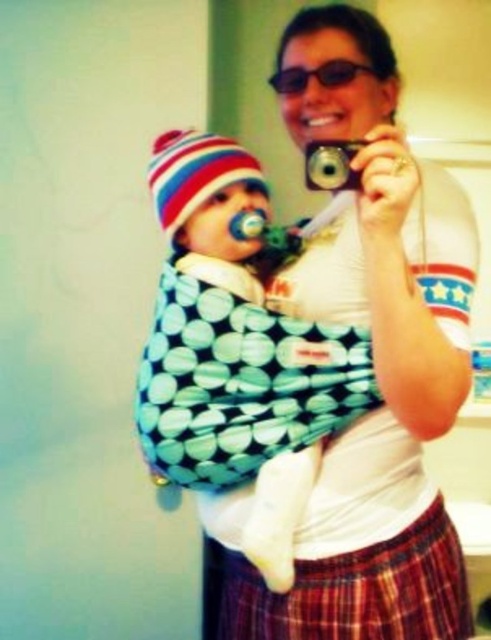
You are a fashion designer observing the image. You need to decide which item is higher up on the person wearing the plaid fabric kilt at lower center and matte black sunglasses at upper center. Which one is higher?

The matte black sunglasses at upper center are higher up because they are positioned at the upper center compared to the plaid fabric kilt at lower center.

You are designing a costume for a play and need to ensure that the plaid fabric kilt at lower center and the matte black sunglasses at upper center fit within a 1.2 meter wide stage backdrop. Given their sizes, can both items be placed side by side without overlapping?

The plaid fabric kilt at lower center is wider than the matte black sunglasses at upper center. Since the total width of both items combined would exceed 1.2 meters, they cannot be placed side by side without overlapping on the backdrop.

You are a photographer trying to capture a candid shot of the baby in the soft cotton baby carrier at center and the matte black sunglasses at upper center. Since you want to ensure both are in focus, which object should you adjust your camera focus on first, the one closer to you or the one farther away?

The soft cotton baby carrier at center is much taller than the matte black sunglasses at upper center, so it is farther away. You should focus on the matte black sunglasses at upper center first since it is closer to you.